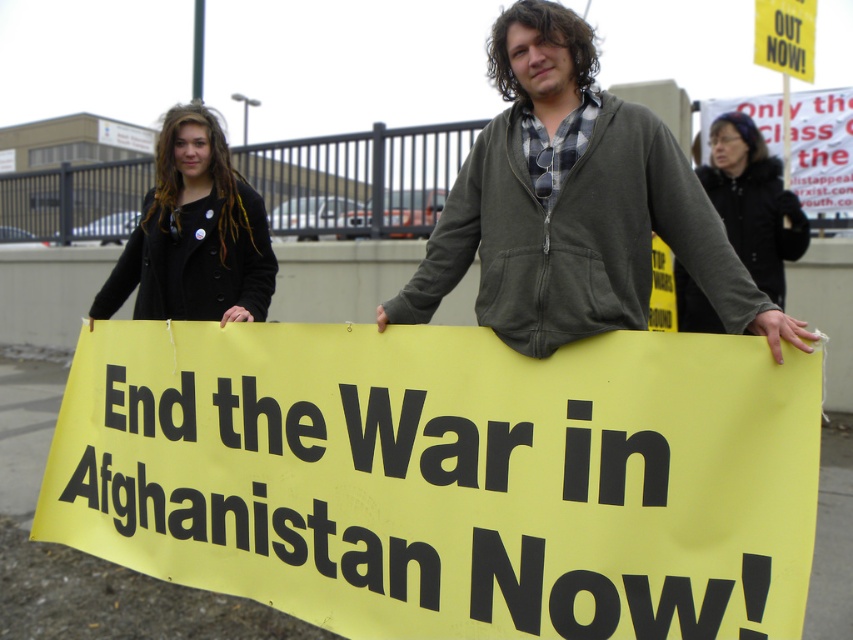
Question: Does dark gray zip-up hoodie at center have a larger size compared to white paper sign at upper right?

Choices:
 (A) no
 (B) yes

Answer: (A)

Question: Which of the following is the closest to the observer?

Choices:
 (A) (585, 278)
 (B) (792, 220)
 (C) (97, 296)

Answer: (A)

Question: Which object is the closest to the black wool coat at upper left?

Choices:
 (A) black fur coat at upper right
 (B) white paper sign at upper right
 (C) yellow paper sign at upper right

Answer: (A)

Question: Does dark gray zip-up hoodie at center appear over black fur coat at upper right?

Choices:
 (A) no
 (B) yes

Answer: (A)

Question: Where is yellow paper sign at center located in relation to black fur coat at upper right in the image?

Choices:
 (A) left
 (B) right

Answer: (A)

Question: Which of the following is the closest to the observer?

Choices:
 (A) (735, 157)
 (B) (598, 122)
 (C) (541, 573)
 (D) (776, 19)

Answer: (C)